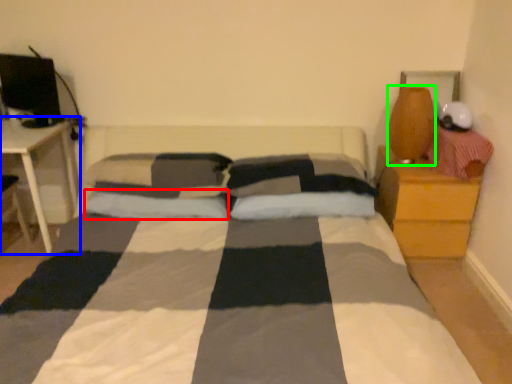
Question: Which is nearer to the pillow (highlighted by a red box)? table (highlighted by a blue box) or table lamp (highlighted by a green box).

Choices:
 (A) table
 (B) table lamp

Answer: (A)